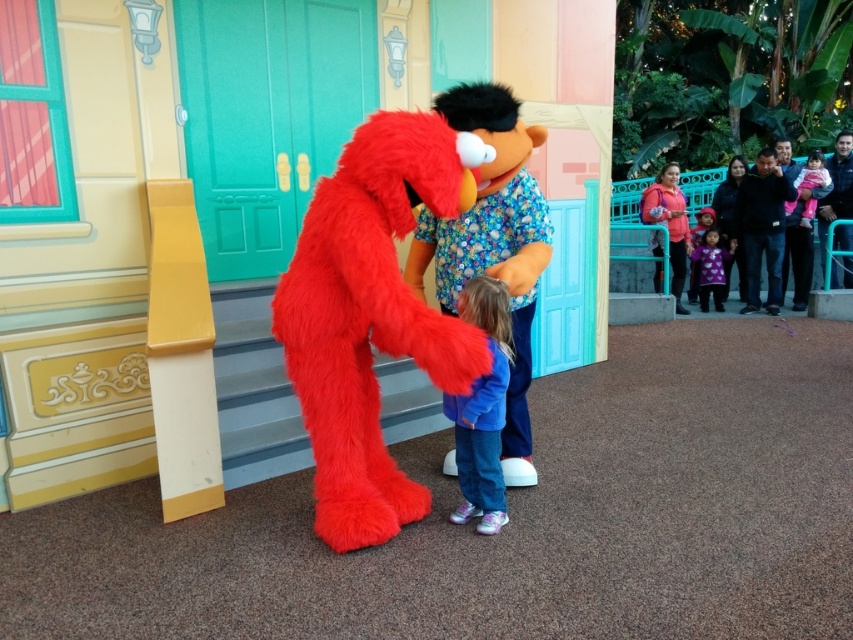
Question: Does purple dotted dress at center lie in front of soft pink fabric at upper right?

Choices:
 (A) yes
 (B) no

Answer: (B)

Question: Which of these objects is positioned closest to the matte pink hoodie at upper right?

Choices:
 (A) purple dotted dress at center
 (B) soft pink fabric at upper right

Answer: (A)

Question: Is purple dotted dress at center below soft pink fabric at upper right?

Choices:
 (A) yes
 (B) no

Answer: (A)

Question: Estimate the real-world distances between objects in this image. Which object is closer to the soft pink fabric at upper right?

Choices:
 (A) purple dotted dress at center
 (B) fuzzy red elmo at left

Answer: (A)

Question: Among these objects, which one is farthest from the camera?

Choices:
 (A) matte pink hoodie at upper right
 (B) purple dotted dress at center

Answer: (B)

Question: Can you confirm if fuzzy red elmo at left is wider than matte pink hoodie at upper right?

Choices:
 (A) no
 (B) yes

Answer: (B)